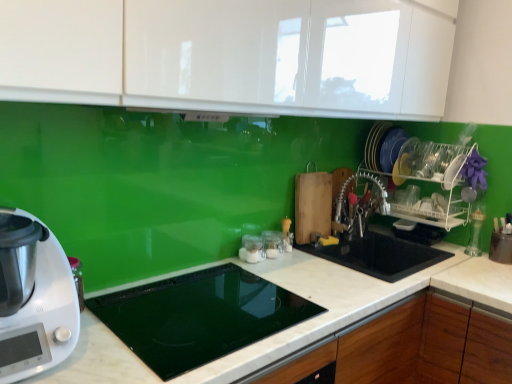
At what (x,y) coordinates should I click in order to perform the action: click on vacant area located to the right-hand side of clear glass jars at center, which is the third appliance from front to back. Please return your answer as a coordinate pair (x, y). Looking at the image, I should click on (309, 260).